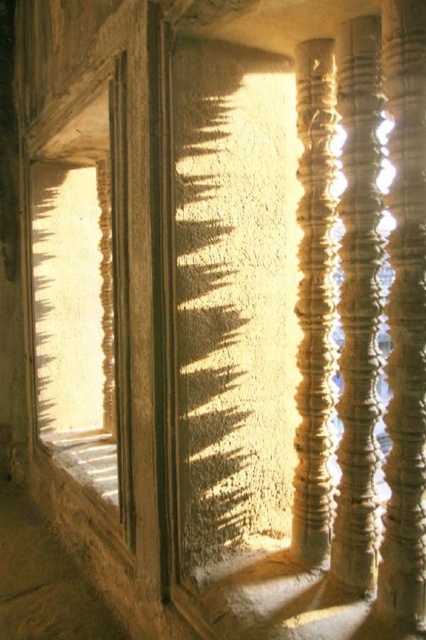
Which is above, matte stone window at left or smooth gold column at center?

matte stone window at left is above.

Is point (65, 454) in front of point (302, 496)?

That is False.

The image size is (426, 640). I want to click on matte stone window at left, so 75,292.

Does matte stone window at left have a greater width compared to smooth stone pillar at right?

Correct, the width of matte stone window at left exceeds that of smooth stone pillar at right.

Between point (69, 241) and point (411, 541), which one is positioned in front?

Point (411, 541) is in front.

Who is more forward, [46,141] or [419,300]?

Point [419,300]

Find the location of a particular element. matte stone window at left is located at coordinates (75, 292).

Does point (405, 484) lie behind point (112, 492)?

No, it is in front of (112, 492).

Find the location of `smooth stone pillar at right`. smooth stone pillar at right is located at coordinates (405, 316).